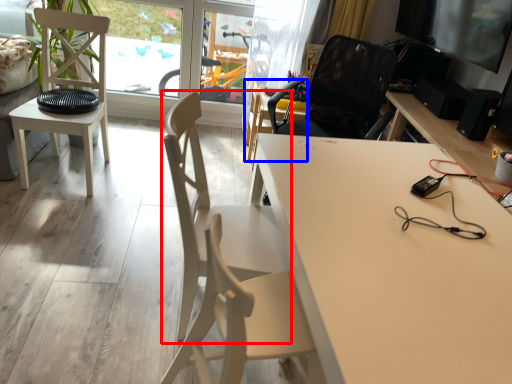
Question: Which object is further to the camera taking this photo, chair (highlighted by a red box) or chair (highlighted by a blue box)?

Choices:
 (A) chair
 (B) chair

Answer: (B)